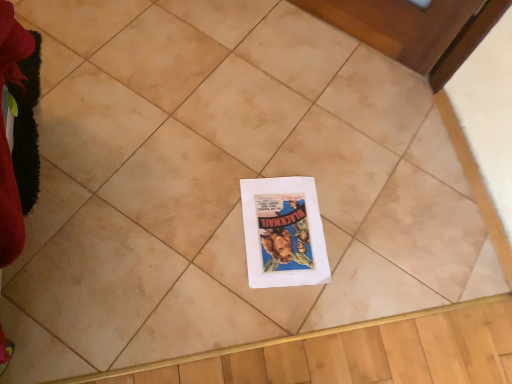
You are a GUI agent. You are given a task and a screenshot of the screen. Output one action in this format:
    pyautogui.click(x=<x>, y=<y>)
    Task: Click on the free spot above white paper flyer at center (from a real-world perspective)
    This screenshot has height=384, width=512.
    Given the screenshot: What is the action you would take?
    pyautogui.click(x=285, y=229)